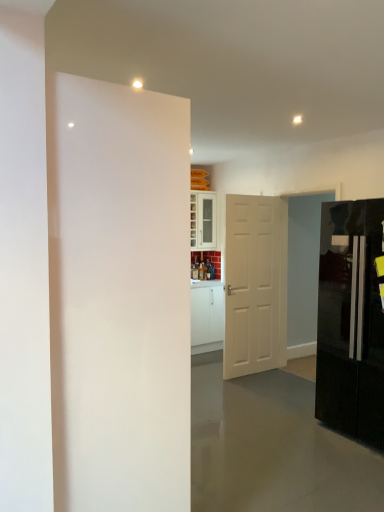
Question: In terms of width, does white matte door at center, which ranks as the 1th door in back-to-front order, look wider or thinner when compared to glossy black refrigerator at right?

Choices:
 (A) thin
 (B) wide

Answer: (A)

Question: Would you say white matte door at center, which is counted as the 2th door, starting from the left, is inside or outside glossy black refrigerator at right?

Choices:
 (A) inside
 (B) outside

Answer: (B)

Question: Which is farther from the white glossy cabinet at center?

Choices:
 (A) white matte door at center, the second door viewed from the front
 (B) white glossy door at left, marked as the first door in a left-to-right arrangement
 (C) glossy black refrigerator at right

Answer: (B)

Question: Which of these objects is positioned closest to the white glossy door at left, marked as the first door in a left-to-right arrangement?

Choices:
 (A) white matte door at center, which is counted as the 2th door, starting from the left
 (B) white glossy cabinet at center
 (C) glossy black refrigerator at right

Answer: (C)